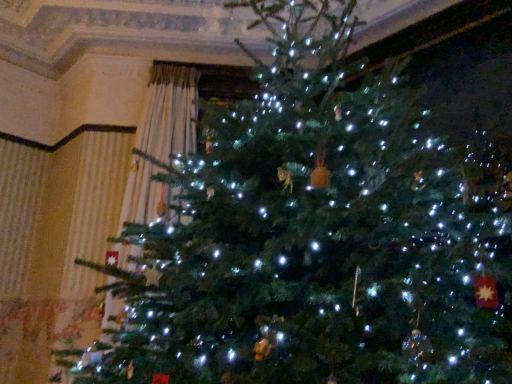
The width and height of the screenshot is (512, 384). What do you see at coordinates (169, 112) in the screenshot?
I see `white sheer curtain at left` at bounding box center [169, 112].

Find the location of `white sheer curtain at left`. white sheer curtain at left is located at coordinates (169, 112).

You are a GUI agent. You are given a task and a screenshot of the screen. Output one action in this format:
    pyautogui.click(x=<x>, y=<y>)
    Task: Click on the white sheer curtain at left
    Image resolution: width=512 pixels, height=384 pixels.
    Given the screenshot: What is the action you would take?
    pyautogui.click(x=169, y=112)